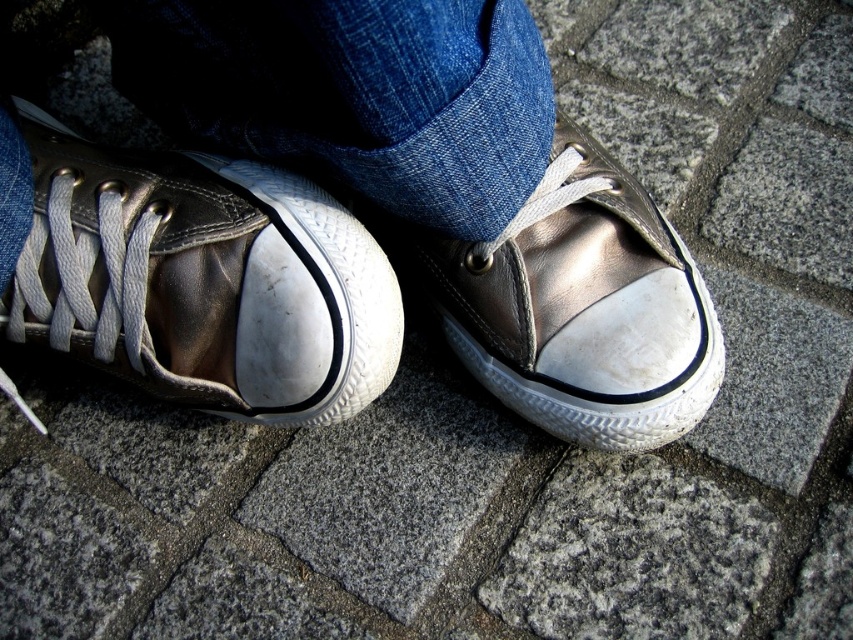
You are standing in front of a pair of sneakers on a cobblestone path. You notice a specific point marked at coordinates (x=202, y=280). Which object does this point correspond to?

The point at coordinates (x=202, y=280) corresponds to the metallic leather sneaker at center.

You are standing in a cobblestone courtyard and see the metallic leather sneaker at center and the metallic leather shoe at center. Which one is closer to you?

The metallic leather sneaker at center is closer to you because it is in front of the metallic leather shoe at center.